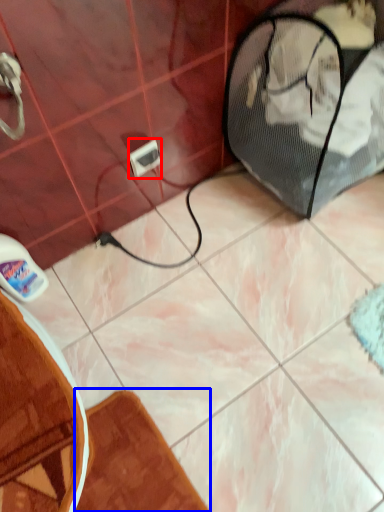
Question: Among these objects, which one is nearest to the camera, electric outlet (highlighted by a red box) or bath mat (highlighted by a blue box)?

Choices:
 (A) electric outlet
 (B) bath mat

Answer: (B)